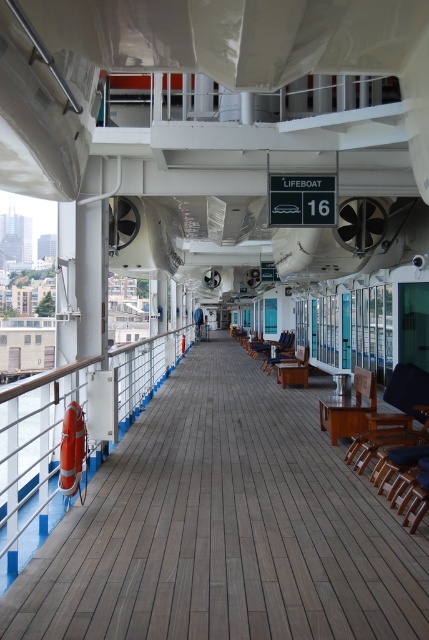
You are a passenger on the cruise ship and want to walk from the orange rubber lifebuoy at left to the wooden at center. Which direction should you move?

You should move to the right to reach the wooden at center from the orange rubber lifebuoy at left since the wooden at center is positioned to the right of the orange rubber lifebuoy at left.

You are a maintenance worker on a cruise ship deck. You need to move a 4 meter long ladder from the wooden at center to the orange rubber lifebuoy at left. Can you safely move the ladder horizontally without tilting it? Explain your reasoning.

The distance between the wooden at center and orange rubber lifebuoy at left is 3.99 meters. Since the ladder is 4 meters long, it is slightly longer than the available space. Therefore, moving the ladder horizontally without tilting it would not be possible as it would exceed the 3.99 meter gap between the two points.

Consider the image. You are standing on the cruise ship deck and want to place a small potted plant. The wooden area at center is the best spot for sunlight. Is the point at coordinates (224, 528) on the wooden area at center?

Yes, the point at coordinates (224, 528) is on the wooden area at center, so you can place the potted plant there.